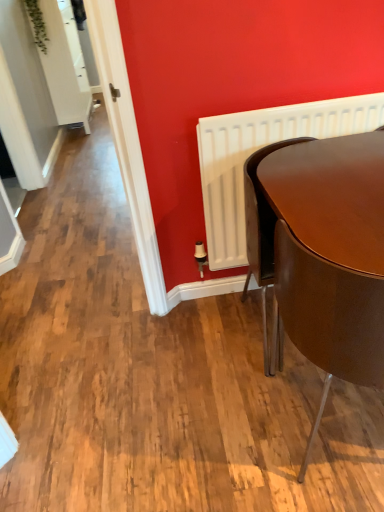
Identify the location of vacant space to the left of glossy brown table at lower right. (228, 339).